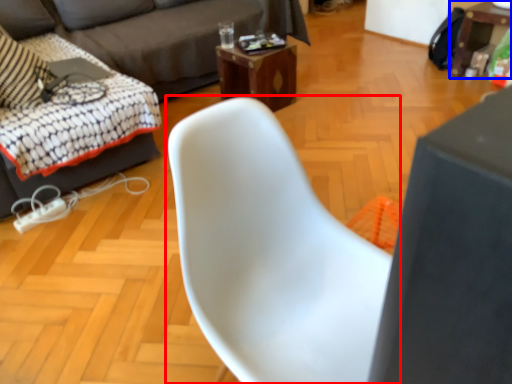
Question: Among these objects, which one is farthest to the camera, chair (highlighted by a red box) or table (highlighted by a blue box)?

Choices:
 (A) chair
 (B) table

Answer: (B)